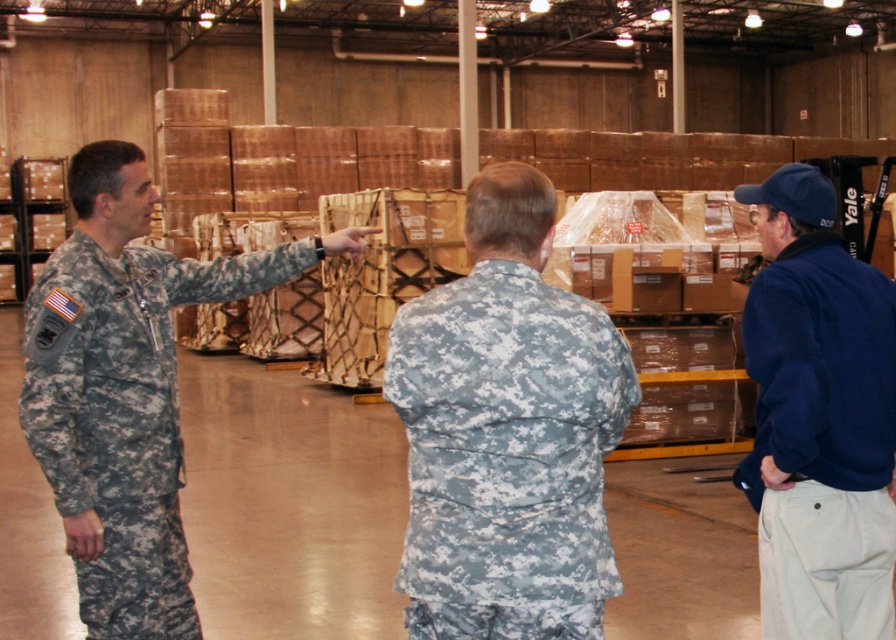
Question: Can you confirm if blue fleece jacket at right is thinner than camouflage fabric uniform at left?

Choices:
 (A) no
 (B) yes

Answer: (B)

Question: Which point is closer to the camera?

Choices:
 (A) (784, 456)
 (B) (131, 588)
 (C) (434, 321)

Answer: (C)

Question: Which of these objects is positioned farthest from the digital camouflage uniform at center?

Choices:
 (A) camouflage fabric uniform at left
 (B) blue fleece jacket at right

Answer: (A)

Question: Does digital camouflage uniform at center appear on the right side of camouflage fabric uniform at left?

Choices:
 (A) no
 (B) yes

Answer: (B)

Question: Which object appears closest to the camera in this image?

Choices:
 (A) digital camouflage uniform at center
 (B) blue fleece jacket at right
 (C) camouflage fabric uniform at left

Answer: (A)

Question: Does digital camouflage uniform at center have a lesser width compared to blue fleece jacket at right?

Choices:
 (A) no
 (B) yes

Answer: (A)